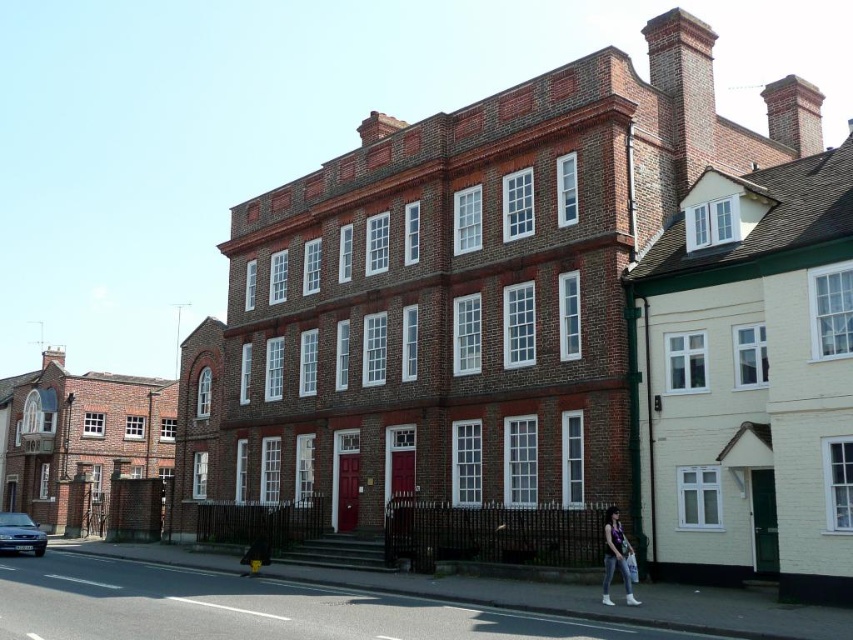
Question: Can you confirm if matte purple top at lower right is wider than metallic blue sedan at lower left?

Choices:
 (A) yes
 (B) no

Answer: (B)

Question: Which object appears closest to the camera in this image?

Choices:
 (A) metallic blue sedan at lower left
 (B) matte purple top at lower right

Answer: (B)

Question: Does matte purple top at lower right come behind metallic blue sedan at lower left?

Choices:
 (A) yes
 (B) no

Answer: (B)

Question: Does matte purple top at lower right appear under metallic blue sedan at lower left?

Choices:
 (A) yes
 (B) no

Answer: (B)